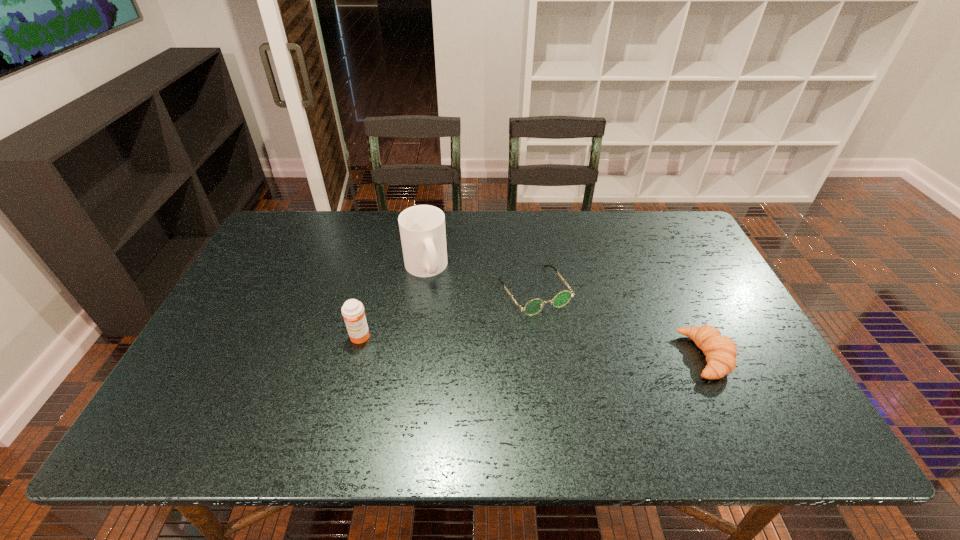
This screenshot has width=960, height=540. What are the coordinates of `the leftmost object` in the screenshot? It's located at (353, 312).

The width and height of the screenshot is (960, 540). I want to click on medicine, so click(353, 312).

The height and width of the screenshot is (540, 960). I want to click on the rightmost object, so click(x=720, y=351).

Locate an element on the screen. This screenshot has height=540, width=960. the third object from right to left is located at coordinates (422, 228).

Identify the location of mug. (422, 228).

At what (x,y) coordinates should I click in order to perform the action: click on spectacles. Please return your answer as a coordinate pair (x, y). This screenshot has height=540, width=960. Looking at the image, I should click on (534, 306).

I want to click on vacant space located on the right of the medicine, so click(424, 338).

Image resolution: width=960 pixels, height=540 pixels. What are the coordinates of `vacant space situated on the front of the crescent roll` in the screenshot? It's located at (728, 401).

Where is `free location located on the handle side of the tallest object`? This screenshot has width=960, height=540. free location located on the handle side of the tallest object is located at coordinates (451, 308).

At what (x,y) coordinates should I click in order to perform the action: click on blank space located 0.080m on the handle side of the tallest object. Please return your answer as a coordinate pair (x, y). Looking at the image, I should click on (446, 301).